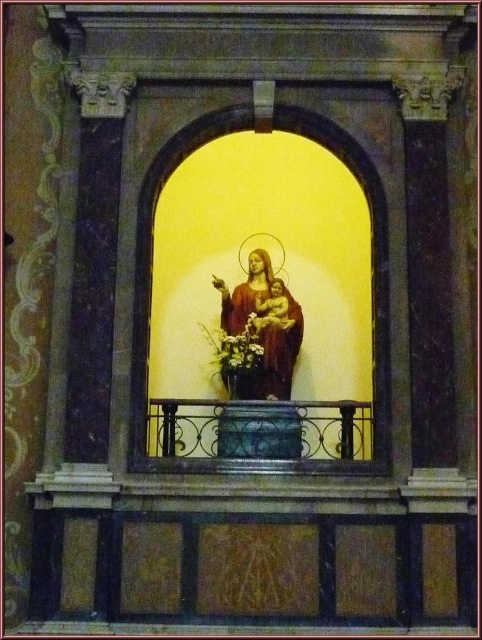
Is black wrought iron balcony at center closer to the viewer compared to yellow matte flower at center?

That is True.

Which is more to the left, black wrought iron balcony at center or yellow matte flower at center?

yellow matte flower at center

This screenshot has width=482, height=640. In order to click on black wrought iron balcony at center in this screenshot , I will do `click(260, 429)`.